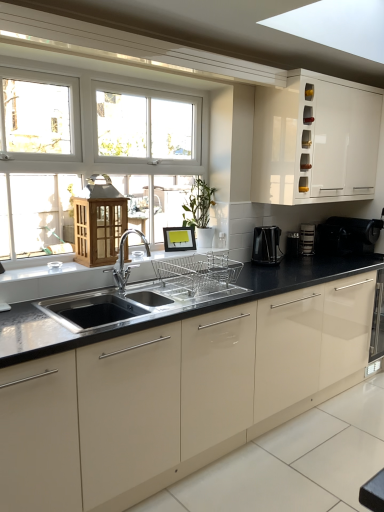
Question: Is the position of black glossy countertop at center more distant than that of black plastic coffee machine at right, the first coffee machine viewed from the right?

Choices:
 (A) yes
 (B) no

Answer: (B)

Question: Is black glossy countertop at center next to black plastic coffee machine at right, which is the second coffee machine in left-to-right order, and touching it?

Choices:
 (A) yes
 (B) no

Answer: (B)

Question: Is black plastic coffee machine at right, the first coffee machine in the back-to-front sequence, surrounded by black glossy countertop at center?

Choices:
 (A) no
 (B) yes

Answer: (A)

Question: Is the position of black glossy countertop at center less distant than that of black plastic coffee machine at right, the first coffee machine viewed from the right?

Choices:
 (A) yes
 (B) no

Answer: (A)

Question: Is black glossy countertop at center positioned with its back to black plastic coffee machine at right, the first coffee machine viewed from the right?

Choices:
 (A) yes
 (B) no

Answer: (B)

Question: Can you confirm if black glossy countertop at center is shorter than black plastic coffee machine at right, the first coffee machine viewed from the right?

Choices:
 (A) yes
 (B) no

Answer: (B)

Question: Is black glossy countertop at center oriented away from black plastic coffee machine at right, which is the 2th coffee machine in right-to-left order?

Choices:
 (A) no
 (B) yes

Answer: (A)

Question: Is black glossy countertop at center bigger than black plastic coffee machine at right, which ranks as the first coffee machine in front-to-back order?

Choices:
 (A) yes
 (B) no

Answer: (A)

Question: Is black glossy countertop at center not within black plastic coffee machine at right, which is the 2th coffee machine in right-to-left order?

Choices:
 (A) no
 (B) yes

Answer: (B)

Question: From a real-world perspective, is black glossy countertop at center positioned under black plastic coffee machine at right, which is the 2th coffee machine in right-to-left order, based on gravity?

Choices:
 (A) no
 (B) yes

Answer: (B)

Question: From the image's perspective, is black glossy countertop at center located beneath black plastic coffee machine at right, which is the 2th coffee machine in right-to-left order?

Choices:
 (A) yes
 (B) no

Answer: (A)

Question: Considering the relative positions of black glossy countertop at center and black plastic coffee machine at right, which ranks as the 2th coffee machine in back-to-front order, in the image provided, is black glossy countertop at center to the left of black plastic coffee machine at right, which ranks as the 2th coffee machine in back-to-front order, from the viewer's perspective?

Choices:
 (A) no
 (B) yes

Answer: (B)

Question: Does black plastic coffee maker at right, which appears as the second appliance when viewed from the left, have a greater width compared to black glossy countertop at center?

Choices:
 (A) no
 (B) yes

Answer: (A)